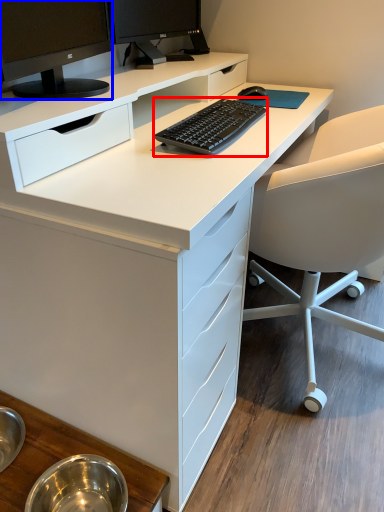
Question: Among these objects, which one is nearest to the camera, computer keyboard (highlighted by a red box) or computer monitor (highlighted by a blue box)?

Choices:
 (A) computer keyboard
 (B) computer monitor

Answer: (B)